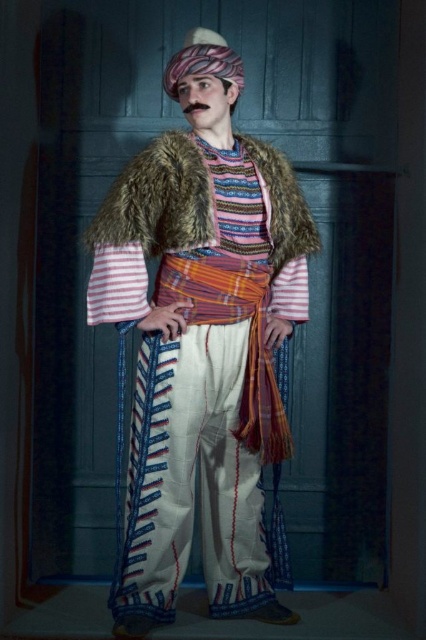
Question: Which object is farther from the camera taking this photo?

Choices:
 (A) fuzzy brown fur coat at center
 (B) striped woolen shirt at center

Answer: (B)

Question: Can you confirm if striped woolen shirt at center is bigger than fuzzy brown fur coat at center?

Choices:
 (A) no
 (B) yes

Answer: (B)

Question: Which point appears farthest from the camera in this image?

Choices:
 (A) (184, 396)
 (B) (138, 173)

Answer: (A)

Question: Is striped woolen shirt at center bigger than fuzzy brown fur coat at center?

Choices:
 (A) no
 (B) yes

Answer: (B)

Question: Does striped woolen shirt at center have a lesser width compared to fuzzy brown fur coat at center?

Choices:
 (A) yes
 (B) no

Answer: (A)